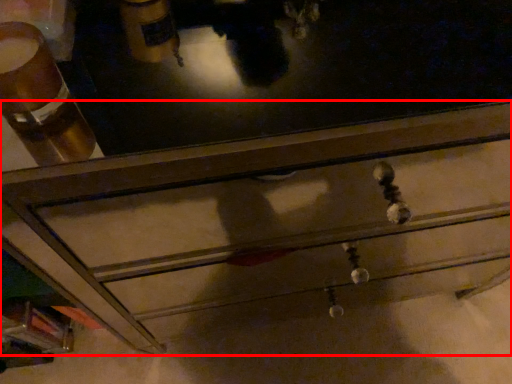
Question: Observing the image, what is the correct spatial positioning of chest of drawers (annotated by the red box) in reference to beverage?

Choices:
 (A) left
 (B) right

Answer: (B)